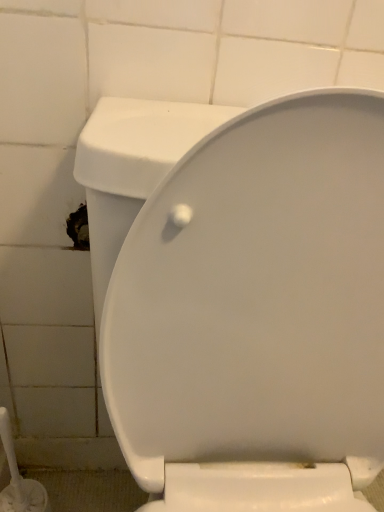
Question: From the image's perspective, is white plastic brush at lower left located above or below white glossy toilet at center?

Choices:
 (A) below
 (B) above

Answer: (A)

Question: Is white plastic brush at lower left in front of or behind white glossy toilet at center in the image?

Choices:
 (A) front
 (B) behind

Answer: (B)

Question: Choose the correct answer: Is white plastic brush at lower left inside white glossy toilet at center or outside it?

Choices:
 (A) outside
 (B) inside

Answer: (A)

Question: Considering the positions of white glossy toilet at center and white plastic brush at lower left in the image, is white glossy toilet at center bigger or smaller than white plastic brush at lower left?

Choices:
 (A) big
 (B) small

Answer: (A)

Question: From a real-world perspective, is white glossy toilet at center physically located above or below white plastic brush at lower left?

Choices:
 (A) below
 (B) above

Answer: (B)

Question: Is point (319, 248) closer or farther from the camera than point (19, 489)?

Choices:
 (A) closer
 (B) farther

Answer: (A)

Question: From the image's perspective, relative to white plastic brush at lower left, is white glossy toilet at center above or below?

Choices:
 (A) above
 (B) below

Answer: (A)